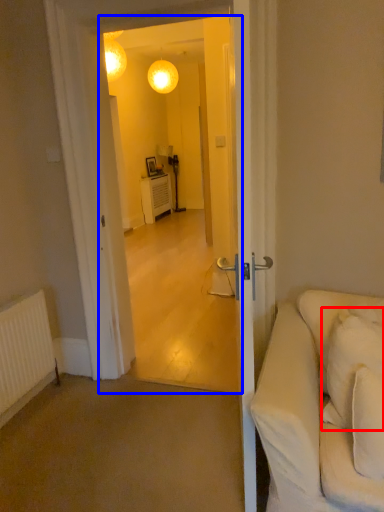
Question: Which object is closer to the camera taking this photo, pillow (highlighted by a red box) or screen door (highlighted by a blue box)?

Choices:
 (A) pillow
 (B) screen door

Answer: (A)